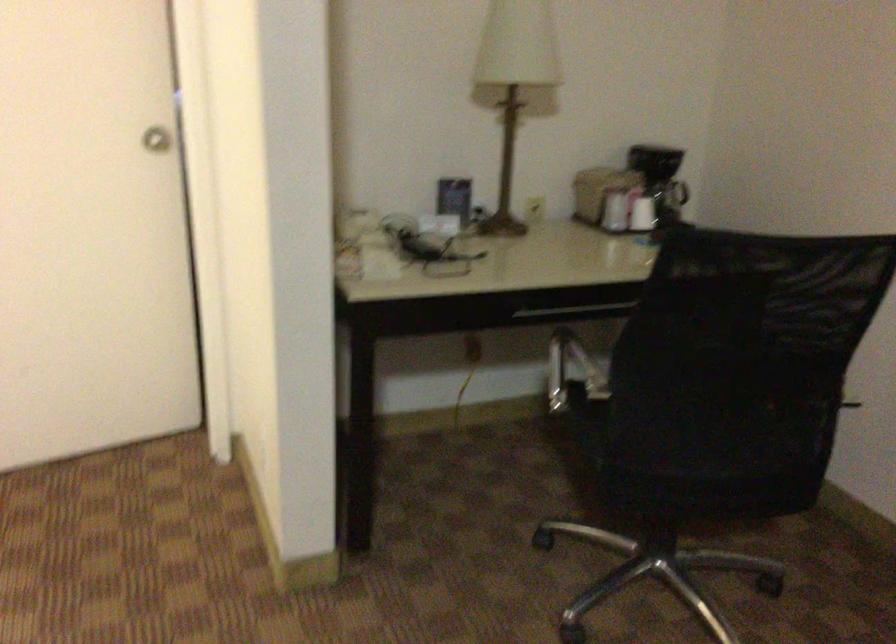
I want to click on black chair armrest, so click(561, 366).